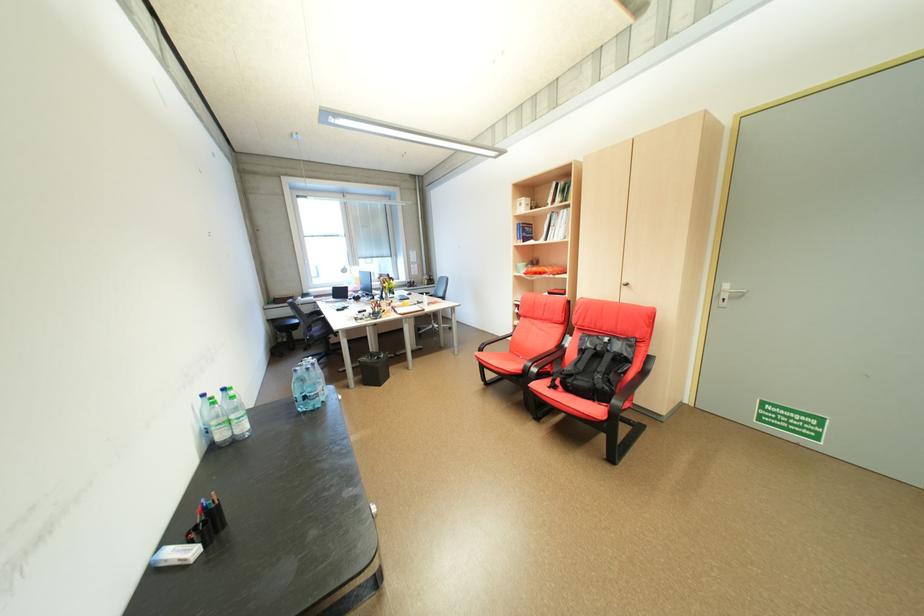
Where is `black chair armrest`? black chair armrest is located at coordinates (493, 341).